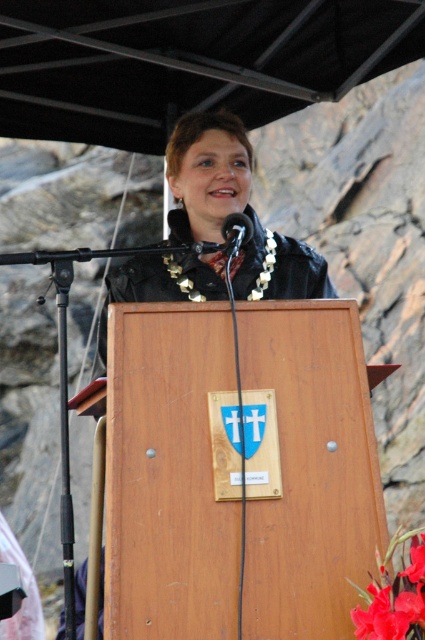
You are a photographer setting up for an outdoor event. You notice the black matte canopy at upper center and the black plastic microphone at center. Which object would you need to adjust your camera focus on first if you want to capture both clearly, considering their sizes?

The black matte canopy at upper center is larger in size than the black plastic microphone at center, so you should focus on the microphone first as it is smaller and requires precise framing to ensure clarity.

You are a photographer setting up for an outdoor event. You need to ensure that the black matte canopy at upper center and the glossy floral at center are both visible in your shot. Given their sizes, which object should you focus on to frame the composition properly?

The black matte canopy at upper center is larger in size than the glossy floral at center, so you should focus on the black matte canopy at upper center to frame the composition properly as it takes up more space in the image.

You are standing at the base of the rock formations and see two points marked in the image. Which point is closer to you, point (x=414, y=582) or point (x=249, y=236)?

Point (x=414, y=582) is in front of point (x=249, y=236), so it is closer to you.